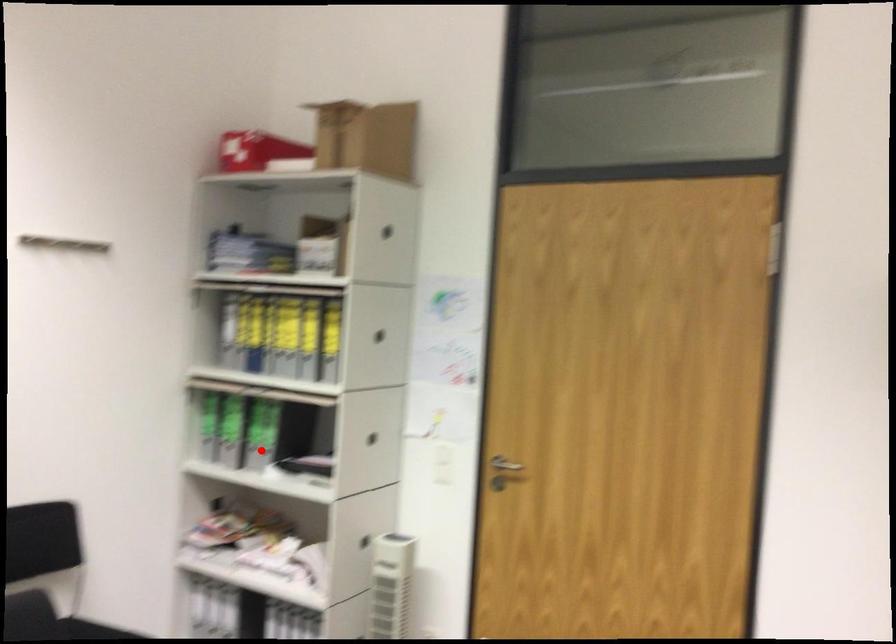
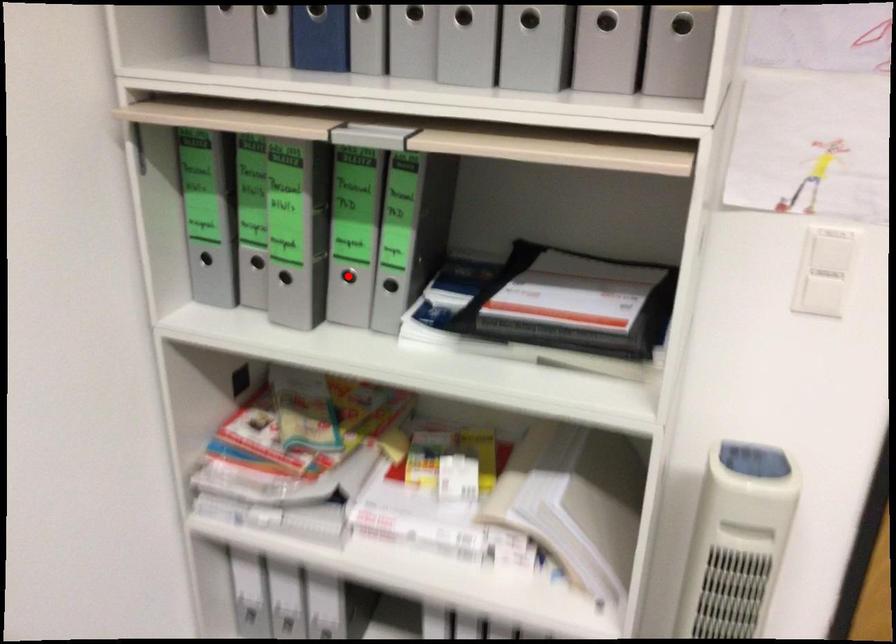
I am providing you with two images of the same scene from different viewpoints. A red point is marked on the first image and another point is marked on the second image. Do the highlighted points in image1 and image2 indicate the same real-world spot?

Yes